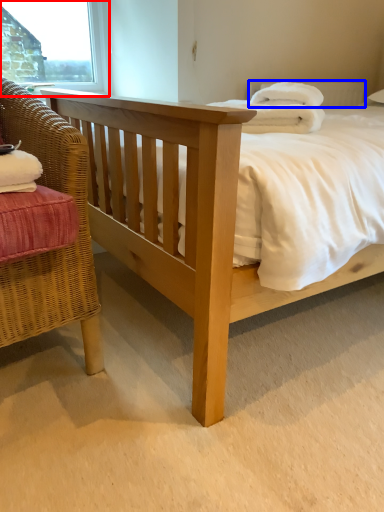
Question: Which of the following is the closest to the observer, window frame (highlighted by a red box) or pillow (highlighted by a blue box)?

Choices:
 (A) window frame
 (B) pillow

Answer: (B)